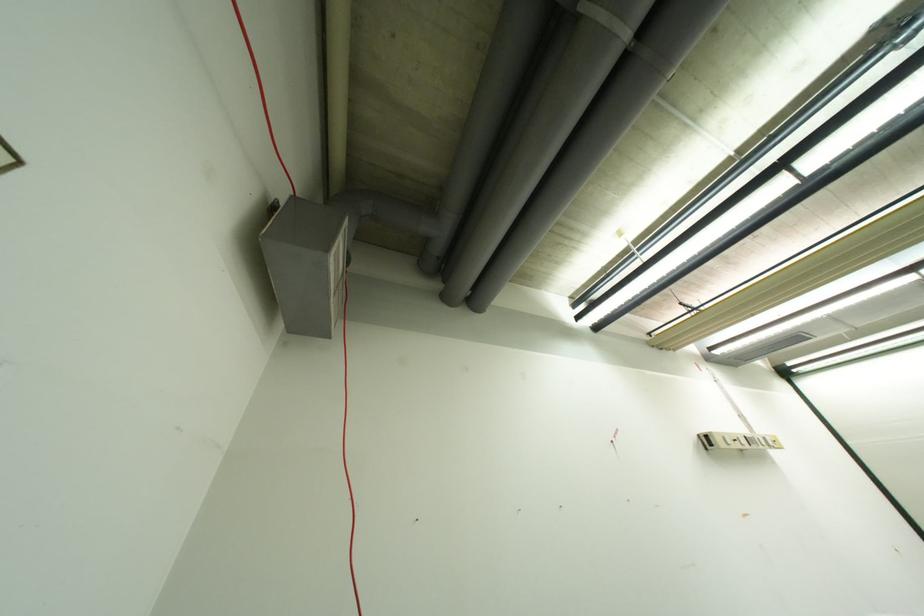
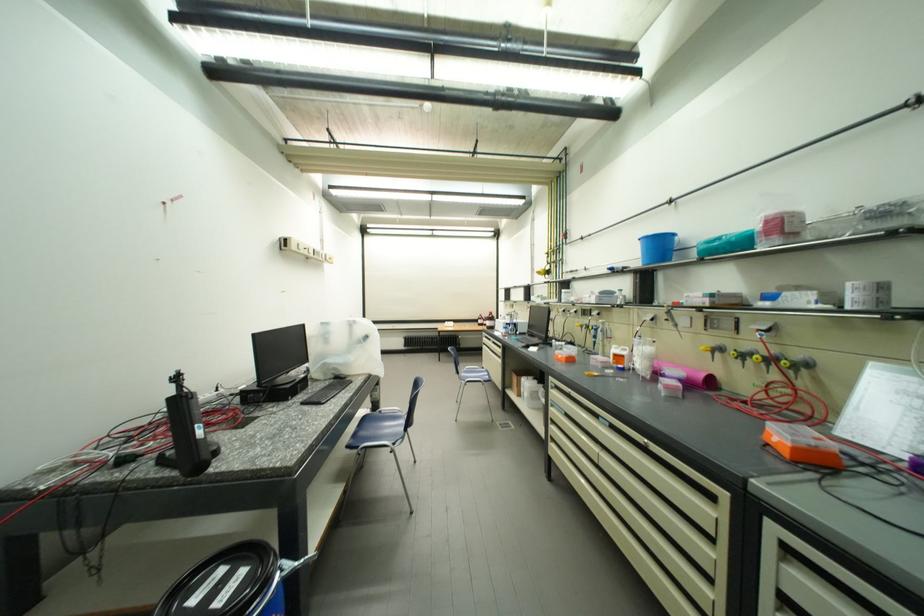
Question: The images are taken continuously from a first-person perspective. In which direction is your viewpoint rotating?

Choices:
 (A) Left
 (B) Right
 (C) Up
 (D) Down

Answer: (B)